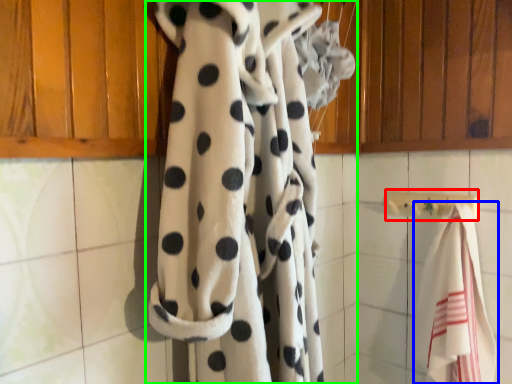
Question: Considering the real-world distances, which object is closest to towel bar (highlighted by a red box)? towel (highlighted by a blue box) or curtain (highlighted by a green box).

Choices:
 (A) towel
 (B) curtain

Answer: (A)